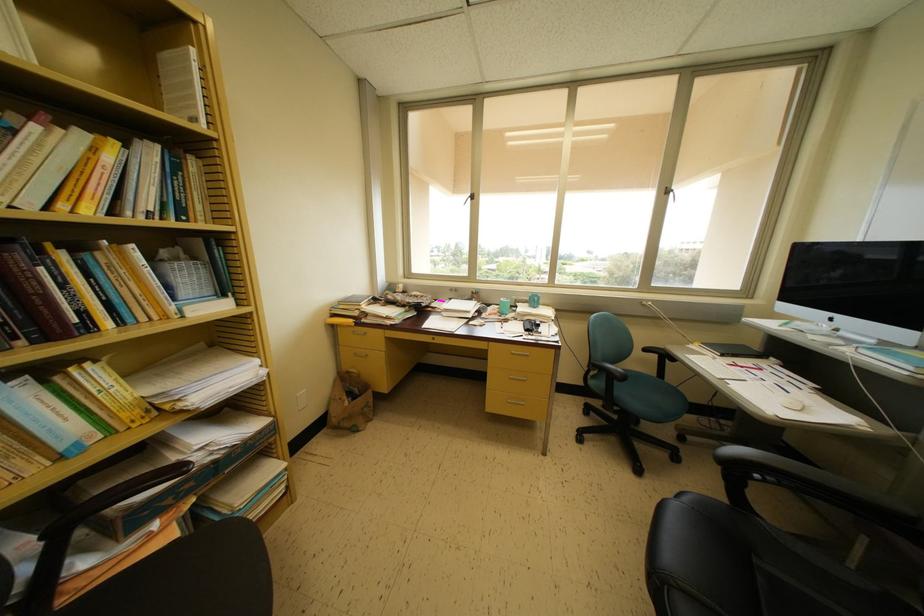
The width and height of the screenshot is (924, 616). In order to click on chair sitting surface in this screenshot , I will do `click(649, 398)`.